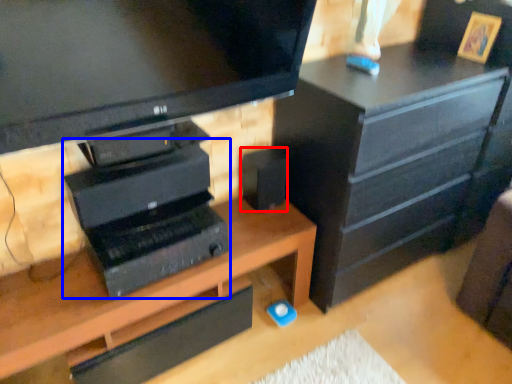
Question: Which of the following is the farthest to the observer, speaker (highlighted by a red box) or computer (highlighted by a blue box)?

Choices:
 (A) speaker
 (B) computer

Answer: (A)